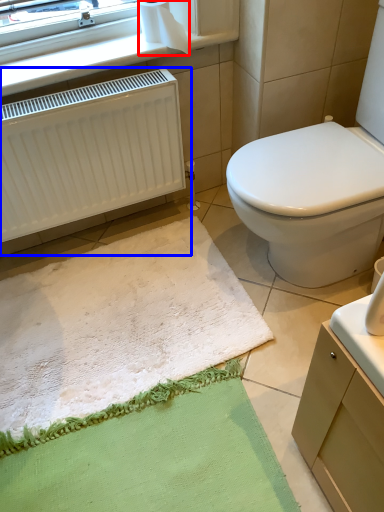
Question: Among these objects, which one is farthest to the camera, toilet paper (highlighted by a red box) or radiator (highlighted by a blue box)?

Choices:
 (A) toilet paper
 (B) radiator

Answer: (A)